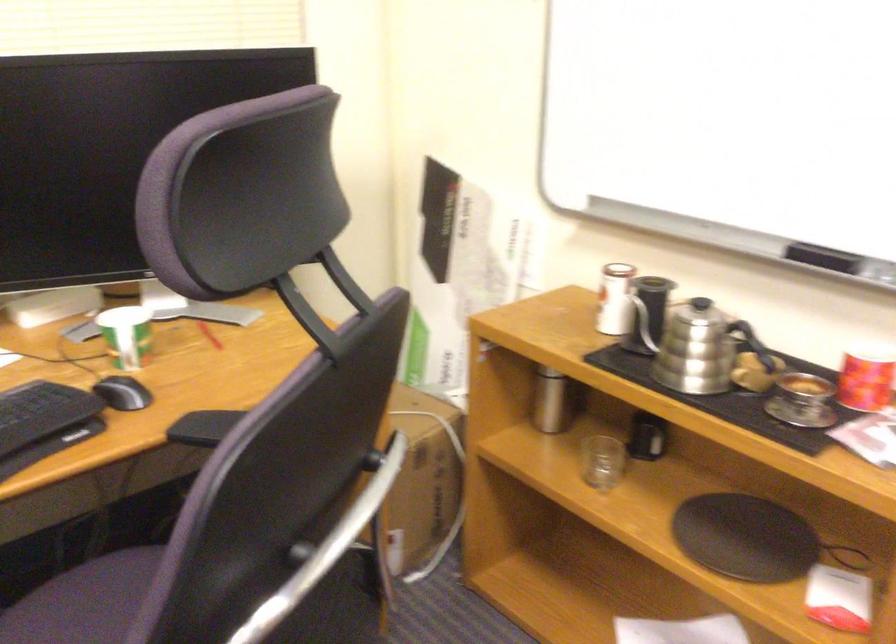
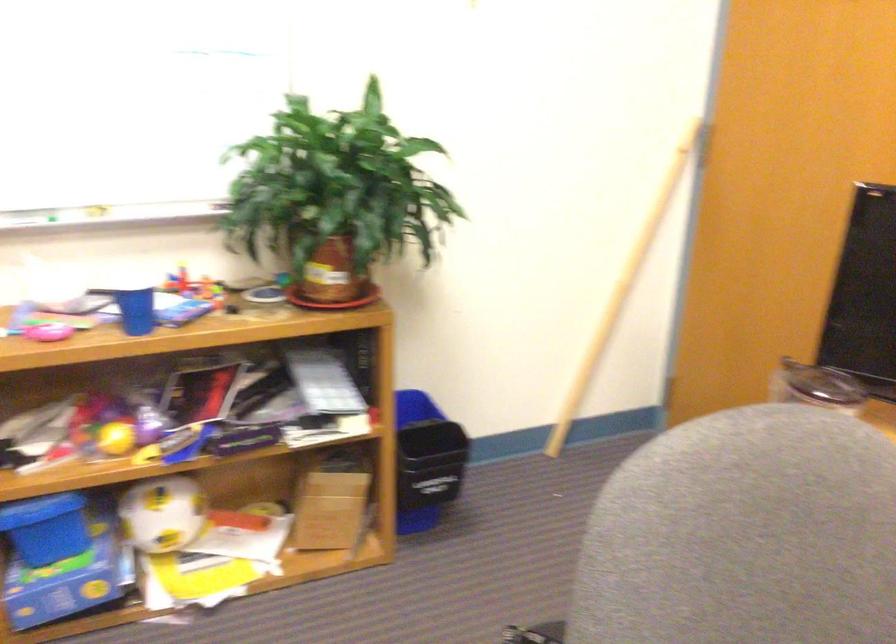
Question: The first image is from the beginning of the video and the second image is from the end. How did the camera likely rotate when shooting the video?

Choices:
 (A) Left
 (B) Right
 (C) Up
 (D) Down

Answer: (B)